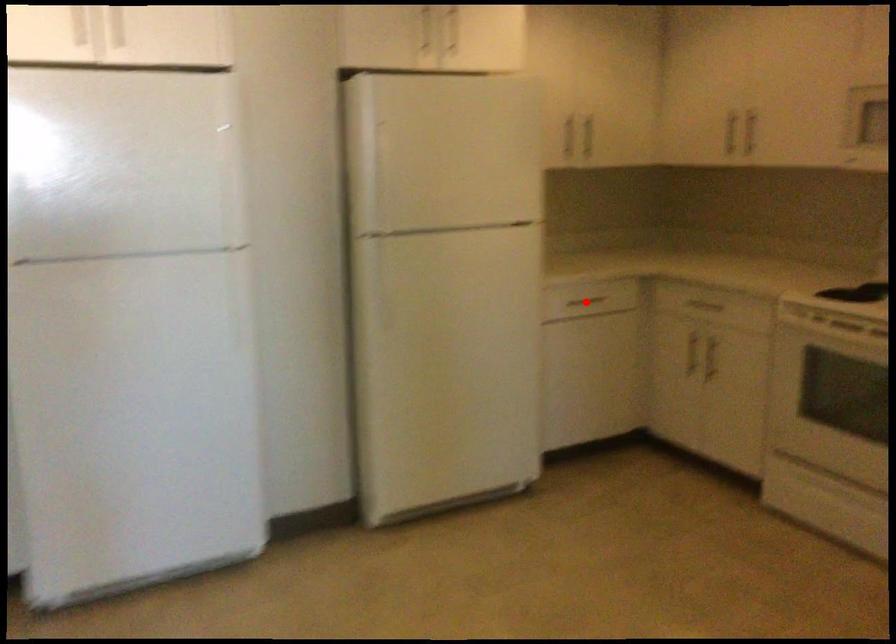
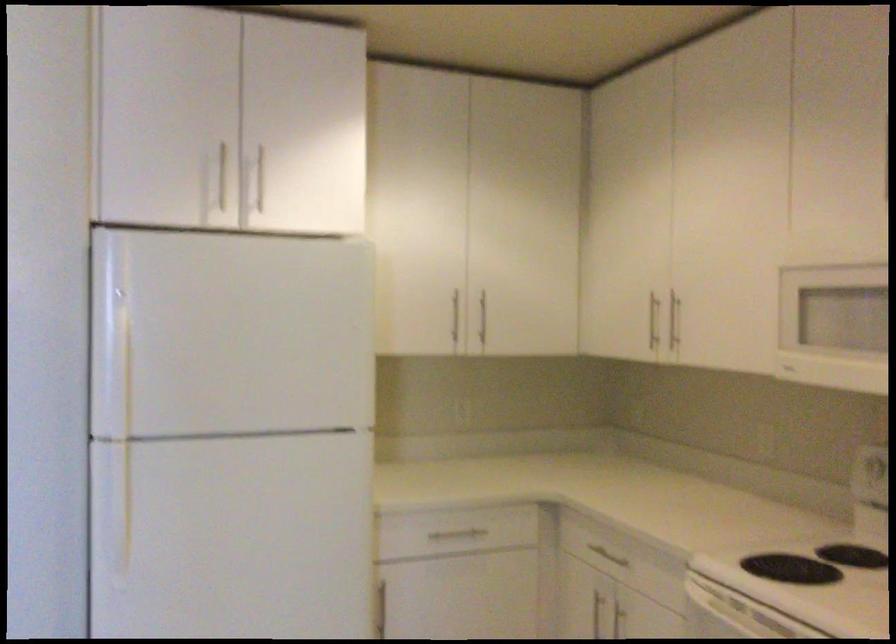
Question: I am providing you with two images of the same scene from different viewpoints. A red point is shown in image1. For the corresponding object point in image2, is it positioned nearer or farther from the camera?

Choices:
 (A) Nearer
 (B) Farther

Answer: (A)